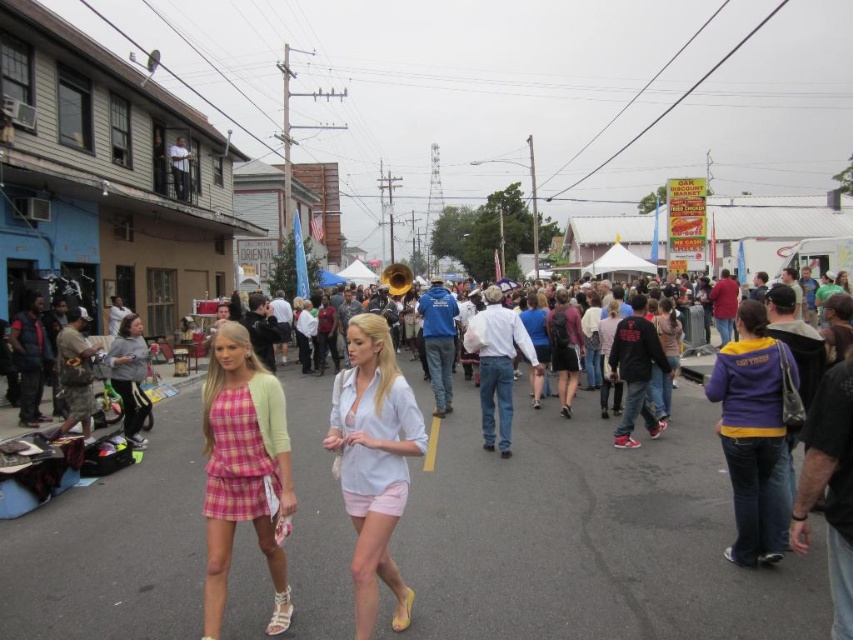
Question: Which object is positioned farthest from the purple/yellow sweater at right?

Choices:
 (A) pink plaid skirt at center
 (B) denim skirt at center
 (C) gray fleece sweatshirt at left
 (D) light pink cotton shorts at center

Answer: (C)

Question: Among these objects, which one is farthest from the camera?

Choices:
 (A) denim skirt at center
 (B) gray fleece sweatshirt at left
 (C) purple/yellow sweater at right
 (D) pink plaid skirt at center

Answer: (B)

Question: Is light pink cotton shorts at center positioned at the back of gray fleece sweatshirt at left?

Choices:
 (A) yes
 (B) no

Answer: (B)

Question: Estimate the real-world distances between objects in this image. Which object is farther from the denim skirt at center?

Choices:
 (A) gray fleece sweatshirt at left
 (B) light pink cotton shorts at center

Answer: (A)

Question: Does pink plaid skirt at center appear on the left side of denim skirt at center?

Choices:
 (A) no
 (B) yes

Answer: (B)

Question: Is light pink cotton shorts at center bigger than gray fleece sweatshirt at left?

Choices:
 (A) yes
 (B) no

Answer: (A)